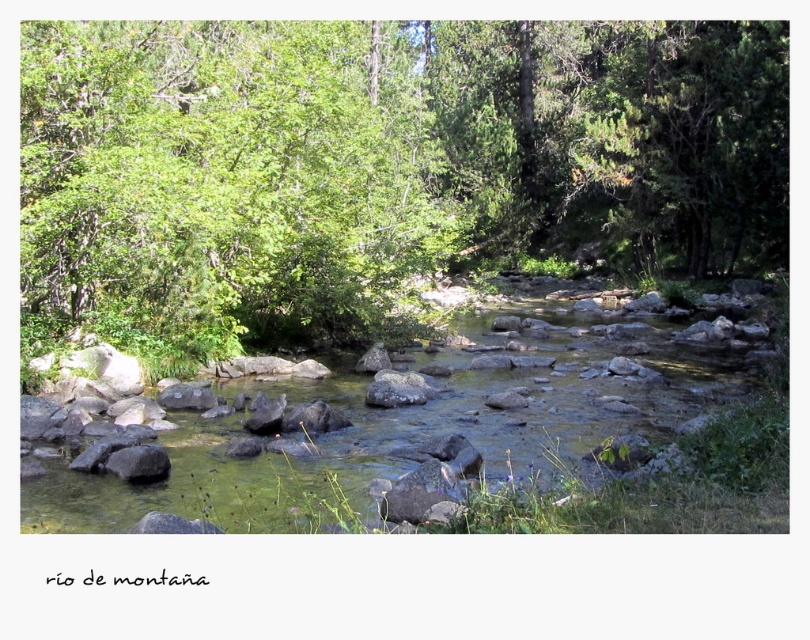
You are a hiker carrying a backpack weighing 15 kilograms. You need to cross the mountain stream shown in the image. The green leafy tree at center is your destination. What is the minimum distance you need to walk to reach the tree from your current position?

The minimum distance you need to walk to reach the green leafy tree at center is 11.18 meters.

You are standing at the origin point of the image. Where is the green leafy tree at center located in terms of coordinates?

The green leafy tree at center is located at coordinates point (384, 161).

You are a hiker who wants to take a photo of the green leafy tree at center and the gray rough rock at lower left. Which object should you focus on first if you want to capture both in a single frame without moving the camera?

The green leafy tree at center is taller than the gray rough rock at lower left, so you should focus on the green leafy tree at center first to ensure its full height is captured in the frame.